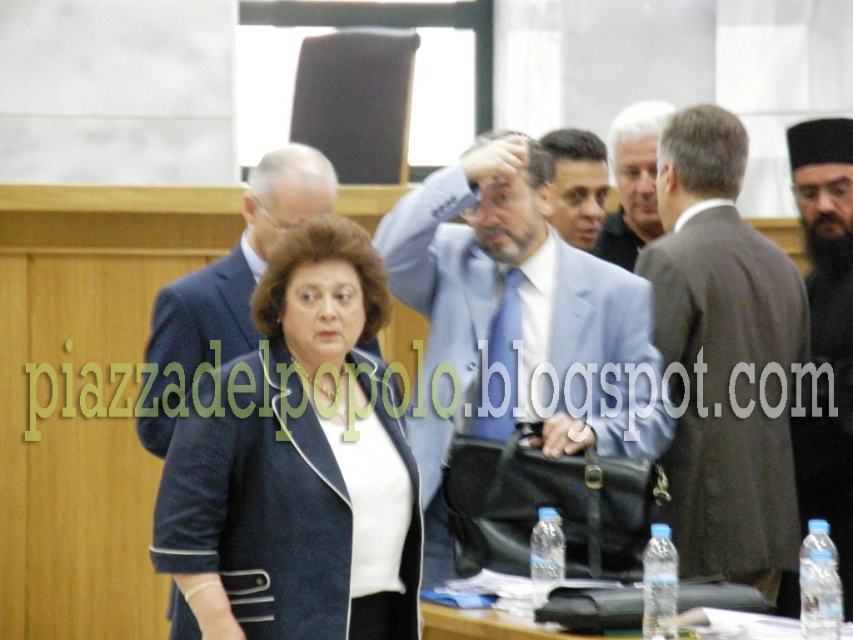
Question: Where is dark brown suit at center located in relation to black velvet hat at upper right in the image?

Choices:
 (A) above
 (B) below

Answer: (B)

Question: Which object is the farthest from the clear plastic water bottles at lower center?

Choices:
 (A) satin light blue suit at center
 (B) matte blue suit at center

Answer: (A)

Question: Can you confirm if matte blue blazer at center is positioned to the left of matte blue suit at center?

Choices:
 (A) no
 (B) yes

Answer: (B)

Question: Which of these objects is positioned farthest from the clear plastic water bottles at lower center?

Choices:
 (A) dark brown suit at center
 (B) matte blue blazer at center

Answer: (A)

Question: Which point is closer to the camera taking this photo?

Choices:
 (A) (640, 161)
 (B) (840, 385)
 (C) (786, 410)

Answer: (C)

Question: From the image, what is the correct spatial relationship of matte blue blazer at center in relation to satin light blue suit at center?

Choices:
 (A) left
 (B) right

Answer: (A)